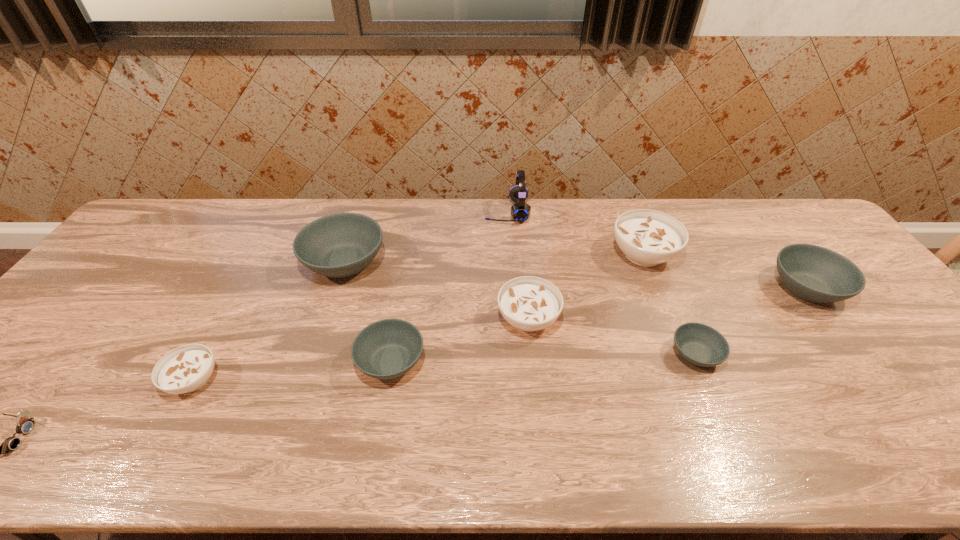
Identify the location of vacant area located 0.130m on the back of the second white soup bowl from right to left. (522, 265).

Locate an element on the screen. The width and height of the screenshot is (960, 540). vacant space located on the back of the second smallest gray soup bowl is located at coordinates (409, 258).

The image size is (960, 540). I want to click on free region located 0.210m on the right of the leftmost soup bowl, so click(310, 380).

The width and height of the screenshot is (960, 540). Identify the location of free location located on the left of the smallest gray soup bowl. (593, 354).

The image size is (960, 540). What are the coordinates of `headset that is positioned at the far edge` in the screenshot? It's located at (520, 211).

At what (x,y) coordinates should I click in order to perform the action: click on object that is at the right edge. Please return your answer as a coordinate pair (x, y). Looking at the image, I should click on (812, 273).

The height and width of the screenshot is (540, 960). Identify the location of free space at the far edge of the desktop. (442, 221).

Where is `vacant region at the near edge`? Image resolution: width=960 pixels, height=540 pixels. vacant region at the near edge is located at coordinates [703, 448].

Locate an element on the screen. The width and height of the screenshot is (960, 540). free spot at the left edge of the desktop is located at coordinates (26, 389).

Where is `blank space at the far left corner of the desktop`? blank space at the far left corner of the desktop is located at coordinates (168, 199).